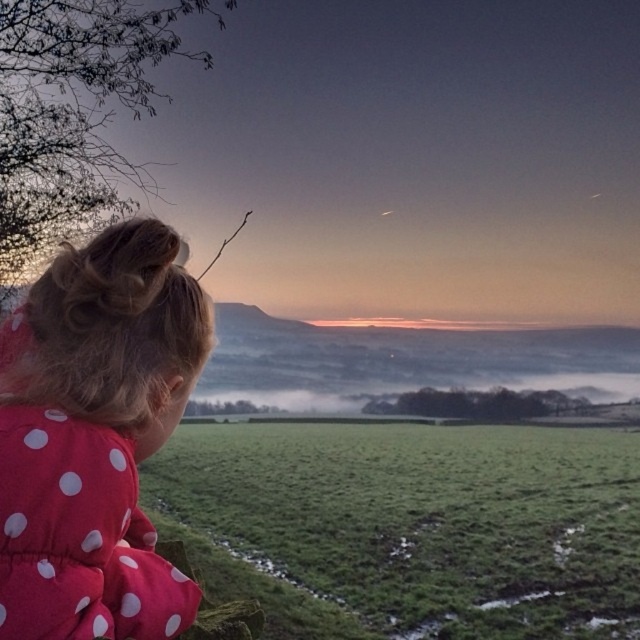
Who is positioned more to the right, green grassy field at lower center or polka dot fabric at left?

From the viewer's perspective, green grassy field at lower center appears more on the right side.

Is green grassy field at lower center behind polka dot fabric at left?

Yes, it is behind polka dot fabric at left.

Which is in front, point (227, 508) or point (145, 600)?

Positioned in front is point (145, 600).

What are the coordinates of `green grassy field at lower center` in the screenshot? It's located at [420, 522].